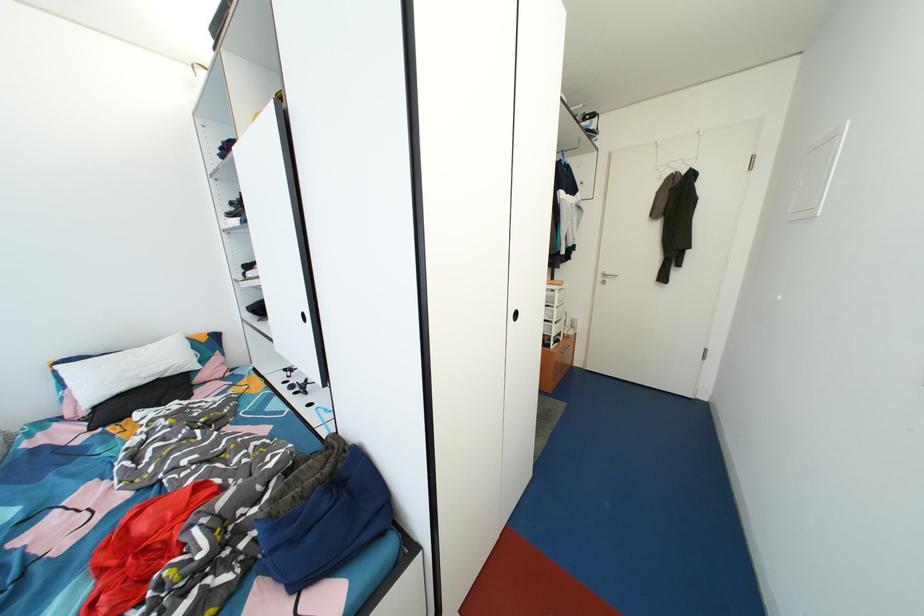
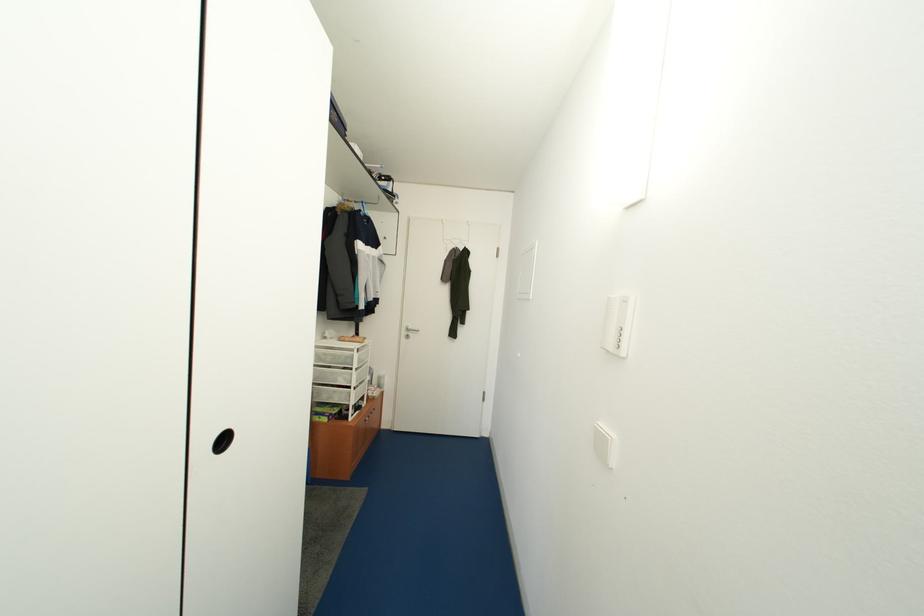
Question: The camera is either moving clockwise (left) or counter-clockwise (right) around the object. The first image is from the beginning of the video and the second image is from the end. Is the camera moving left or right when shooting the video?

Choices:
 (A) Left
 (B) Right

Answer: (A)